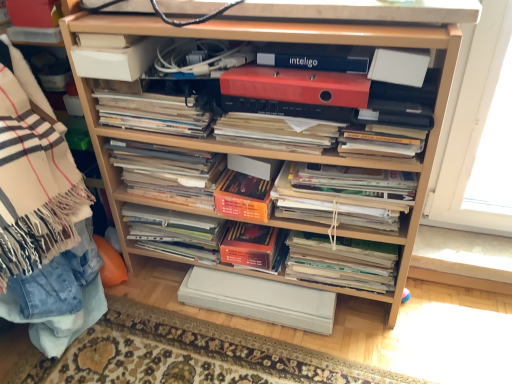
Question: Is there a large distance between blue matte inteligo at upper center, which appears as the second paperback book when viewed from the top, and white matte paper at upper left, the first paperback book in the top-to-bottom sequence?

Choices:
 (A) yes
 (B) no

Answer: (B)

Question: Is blue matte inteligo at upper center, which appears as the sixth paperback book when ordered from the bottom, further to the viewer compared to white matte paper at upper left, the seventh paperback book positioned from the bottom?

Choices:
 (A) no
 (B) yes

Answer: (A)

Question: Is blue matte inteligo at upper center, which appears as the sixth paperback book when ordered from the bottom, smaller than white matte paper at upper left, the first paperback book in the top-to-bottom sequence?

Choices:
 (A) yes
 (B) no

Answer: (A)

Question: Is the depth of blue matte inteligo at upper center, which appears as the second paperback book when viewed from the top, less than that of white matte paper at upper left, the seventh paperback book positioned from the bottom?

Choices:
 (A) yes
 (B) no

Answer: (A)

Question: From a real-world perspective, is blue matte inteligo at upper center, which appears as the sixth paperback book when ordered from the bottom, under white matte paper at upper left, the seventh paperback book positioned from the bottom?

Choices:
 (A) no
 (B) yes

Answer: (A)

Question: Is blue matte inteligo at upper center, which appears as the sixth paperback book when ordered from the bottom, positioned beyond the bounds of white matte paper at upper left, the seventh paperback book positioned from the bottom?

Choices:
 (A) no
 (B) yes

Answer: (B)

Question: From the image's perspective, is white paper magazine at center, placed as the 5th magazine when sorted from top to bottom, located beneath wooden shelf at left?

Choices:
 (A) yes
 (B) no

Answer: (A)

Question: From a real-world perspective, is white paper magazine at center, placed as the 5th magazine when sorted from top to bottom, positioned over wooden shelf at left based on gravity?

Choices:
 (A) no
 (B) yes

Answer: (A)

Question: From the image's perspective, is white paper magazine at center, placed as the 5th magazine when sorted from top to bottom, located above wooden shelf at left?

Choices:
 (A) yes
 (B) no

Answer: (B)

Question: Is white paper magazine at center, positioned as the third magazine in bottom-to-top order, surrounding wooden shelf at left?

Choices:
 (A) yes
 (B) no

Answer: (B)

Question: Does white paper magazine at center, positioned as the third magazine in bottom-to-top order, have a lesser width compared to wooden shelf at left?

Choices:
 (A) no
 (B) yes

Answer: (B)

Question: Is white paper magazine at center, positioned as the third magazine in bottom-to-top order, oriented towards wooden shelf at left?

Choices:
 (A) yes
 (B) no

Answer: (B)

Question: Can you confirm if matte black magazine at center, which is the second magazine from top to bottom, is wider than white matte paper at upper right, the fourth paperback book from the top?

Choices:
 (A) no
 (B) yes

Answer: (B)